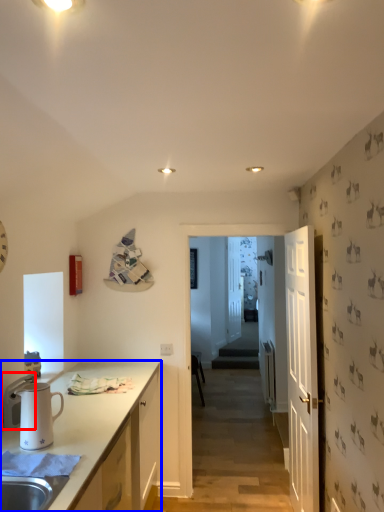
Question: Which object is further to the camera taking this photo, appliance (highlighted by a red box) or cabinetry (highlighted by a blue box)?

Choices:
 (A) appliance
 (B) cabinetry

Answer: (A)